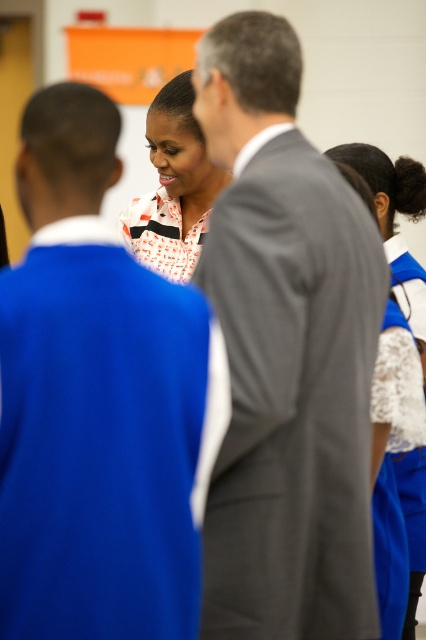
Measure the distance between point (342, 362) and camera.

The distance of point (342, 362) from camera is 2.39 meters.

Is gray suit at center below white lace blouse at right?

Yes, gray suit at center is below white lace blouse at right.

Between point (268, 477) and point (389, 262), which one is positioned behind?

The point (389, 262) is more distant.

This screenshot has height=640, width=426. I want to click on gray suit at center, so click(x=285, y=355).

Is gray suit at center bigger than white printed blouse at center?

Correct, gray suit at center is larger in size than white printed blouse at center.

Can you confirm if gray suit at center is thinner than white printed blouse at center?

No.

Which is behind, point (235, 412) or point (147, 131)?

Positioned behind is point (147, 131).

Where is `gray suit at center`? gray suit at center is located at coordinates (285, 355).

Does white printed blouse at center have a greater width compared to white lace blouse at right?

Yes.

Does white printed blouse at center appear under white lace blouse at right?

Actually, white printed blouse at center is above white lace blouse at right.

Which is behind, point (195, 170) or point (408, 257)?

The point (195, 170) is more distant.

The width and height of the screenshot is (426, 640). I want to click on white printed blouse at center, so click(x=173, y=186).